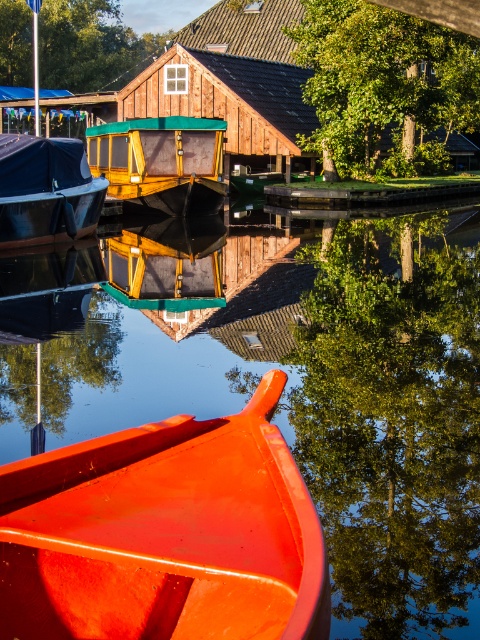
Measure the distance from green leafy tree at upper left to matte black tarpaulin at left.

43.35 meters

Is green leafy tree at upper left further to camera compared to matte black tarpaulin at left?

Yes, it is behind matte black tarpaulin at left.

Between point (61, 12) and point (54, 209), which one is positioned behind?

The point (61, 12) is behind.

Where is `green leafy tree at upper left`? The image size is (480, 640). green leafy tree at upper left is located at coordinates coord(91,45).

Which is more to the right, glossy orange canoe at lower center or green leafy tree at upper left?

From the viewer's perspective, glossy orange canoe at lower center appears more on the right side.

Which is behind, point (215, 465) or point (136, 52)?

The point (136, 52) is more distant.

This screenshot has width=480, height=640. Identify the location of glossy orange canoe at lower center. (165, 534).

In the scene shown: Can you confirm if glossy orange canoe at lower center is smaller than wooden cabin cruiser at center?

No, glossy orange canoe at lower center is not smaller than wooden cabin cruiser at center.

Between glossy orange canoe at lower center and wooden cabin cruiser at center, which one is positioned lower?

Positioned lower is glossy orange canoe at lower center.

Which is in front, point (79, 531) or point (139, 124)?

Point (79, 531) is in front.

Find the location of a particular element. glossy orange canoe at lower center is located at coordinates (165, 534).